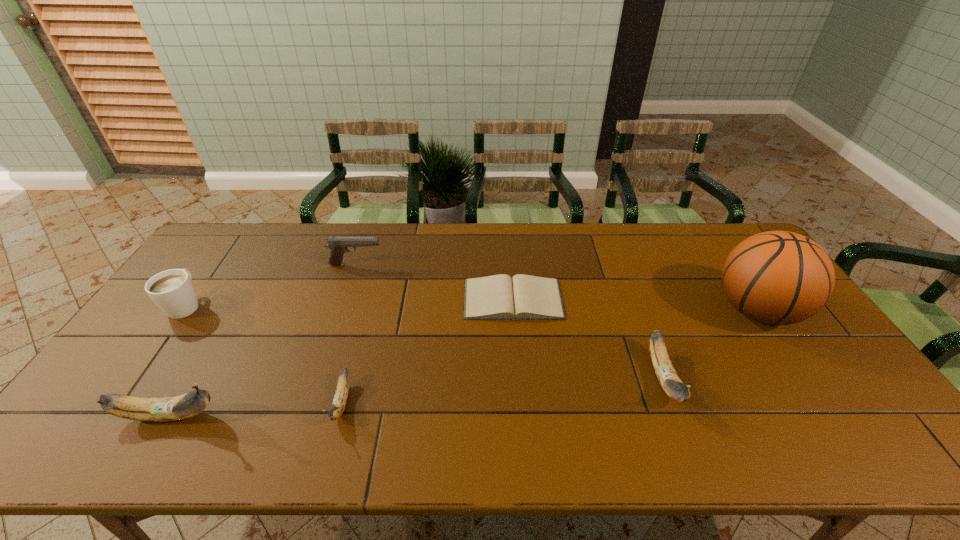
Point out which banana is positioned as the nearest to the farthest object. Please provide its 2D coordinates. Your answer should be formatted as a tuple, i.e. [(x, y)], where the tuple contains the x and y coordinates of a point satisfying the conditions above.

[(340, 398)]

At what (x,y) coordinates should I click in order to perform the action: click on the third closest banana to the Bible. Please return your answer as a coordinate pair (x, y). The height and width of the screenshot is (540, 960). Looking at the image, I should click on (160, 409).

I want to click on blank area in the image that satisfies the following two spatial constraints: 1. on the back side of the Bible; 2. at the barrel of the pistol, so click(510, 265).

This screenshot has width=960, height=540. Find the location of `vacant space that satisfies the following two spatial constraints: 1. on the back side of the rightmost object; 2. at the barrel of the farthest object`. vacant space that satisfies the following two spatial constraints: 1. on the back side of the rightmost object; 2. at the barrel of the farthest object is located at coordinates (727, 265).

This screenshot has width=960, height=540. Find the location of `free space that satisfies the following two spatial constraints: 1. on the peel of the shortest banana; 2. on the peel of the leftmost banana`. free space that satisfies the following two spatial constraints: 1. on the peel of the shortest banana; 2. on the peel of the leftmost banana is located at coordinates (338, 416).